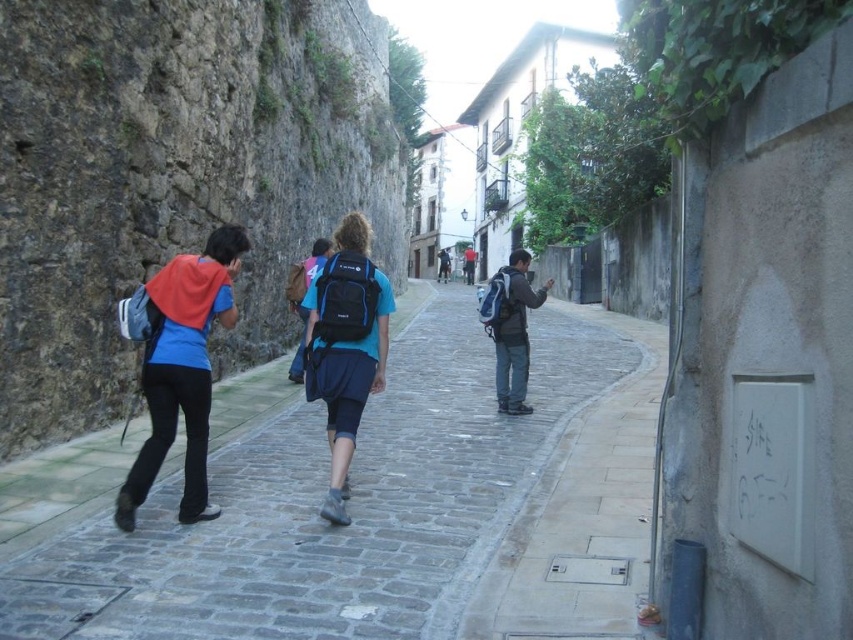
You are a traveler walking along the narrow cobblestone street and see both the matte blue backpack at left and the blue matte backpack at center. Which backpack is closer to the left side of the street?

The matte blue backpack at left is closer to the left side of the street because it is positioned on the left side of the blue matte backpack at center.